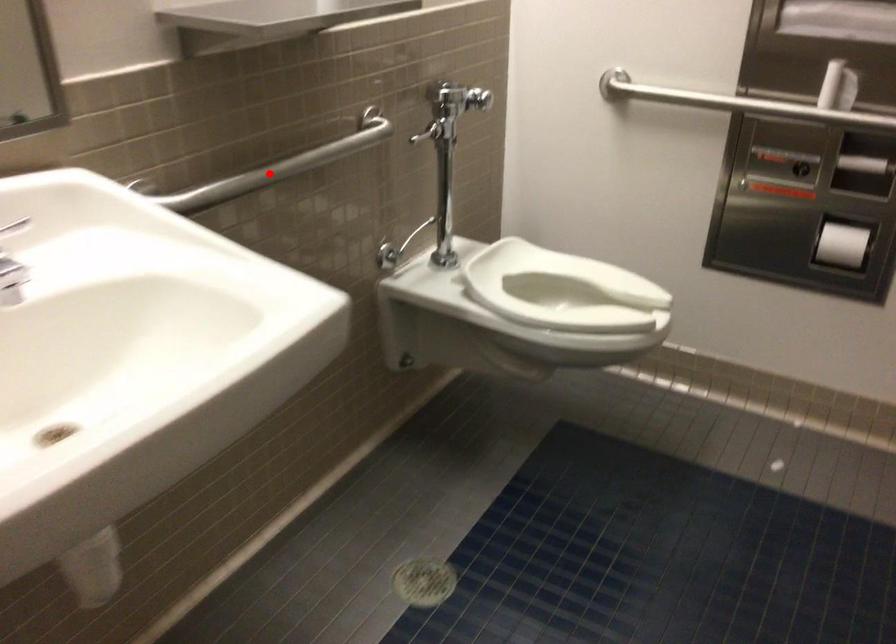
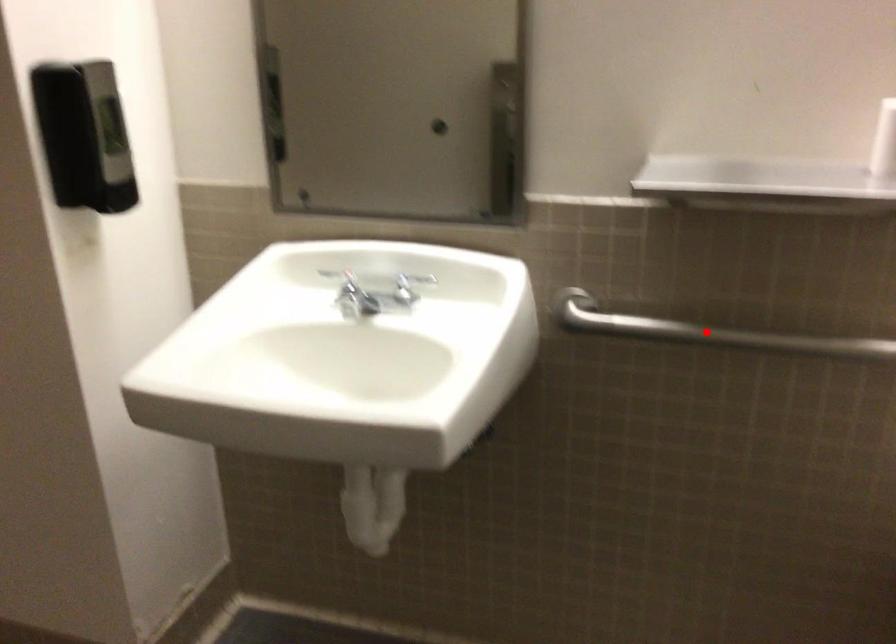
Looking at this image, I am providing you with two images of the same scene from different viewpoints. A red point is marked on the first image and another point is marked on the second image. Are the points marked in image1 and image2 representing the same 3D position?

Yes